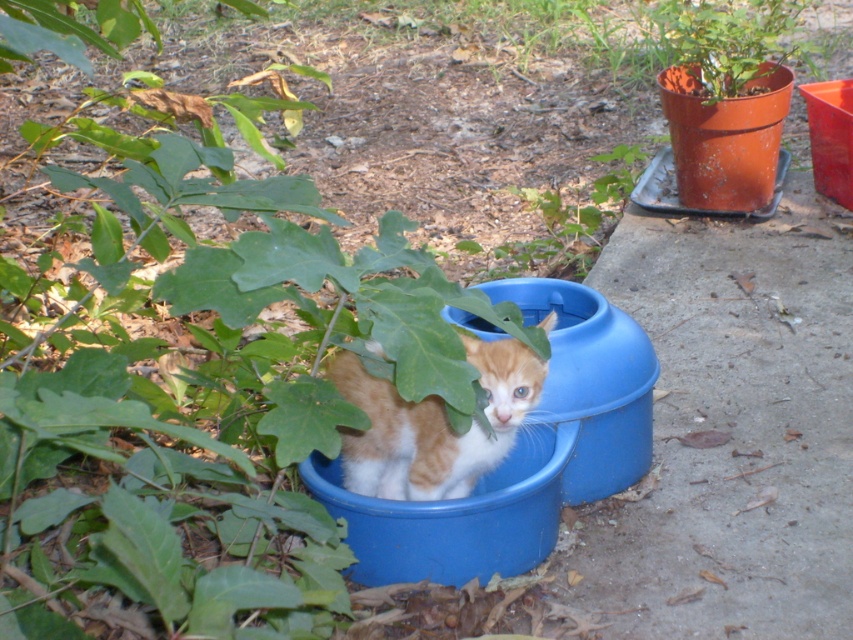
You are a gardener who wants to water the plants in the scene. You have a watering can in your left hand and need to reach the matte orange pot at upper right and the green leafy plant at upper center. Which one can you reach first without moving your feet?

The matte orange pot at upper right is in front of the green leafy plant at upper center, so you can reach the matte orange pot at upper right first without moving your feet.

You are a photographer setting up a shot of the orange fur kitten at center and the green leafy plant at upper center. You want to ensure both subjects are in focus. Which subject should you focus on first to maintain depth of field?

The orange fur kitten at center is shorter than the green leafy plant at upper center, so you should focus on the green leafy plant at upper center first as it is farther away to ensure both are in focus.

You are a photographer trying to capture the orange fur kitten at center in a natural outdoor setting. Based on the scene description, where should you position your camera to ensure the kitten is centered in the frame?

The orange fur kitten at center is located at coordinates point (433, 426), so positioning the camera at that point would center the kitten in the frame.